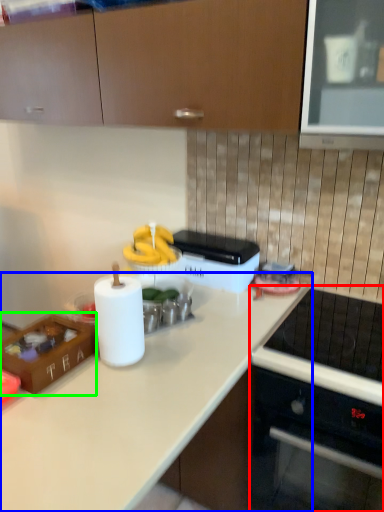
Question: Which object is positioned farthest from home appliance (highlighted by a red box)? Select from countertop (highlighted by a blue box) and kitchen appliance (highlighted by a green box).

Choices:
 (A) countertop
 (B) kitchen appliance

Answer: (B)